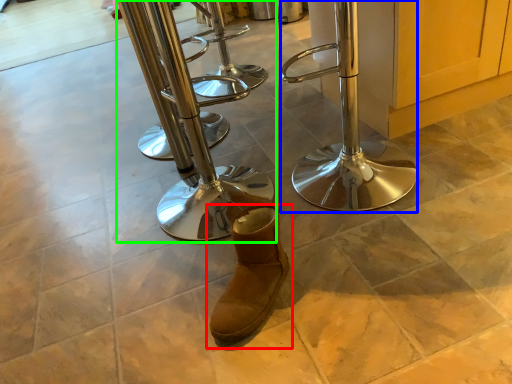
Question: Estimate the real-world distances between objects in this image. Which object is closer to footwear (highlighted by a red box), step stool (highlighted by a blue box) or step stool (highlighted by a green box)?

Choices:
 (A) step stool
 (B) step stool

Answer: (A)